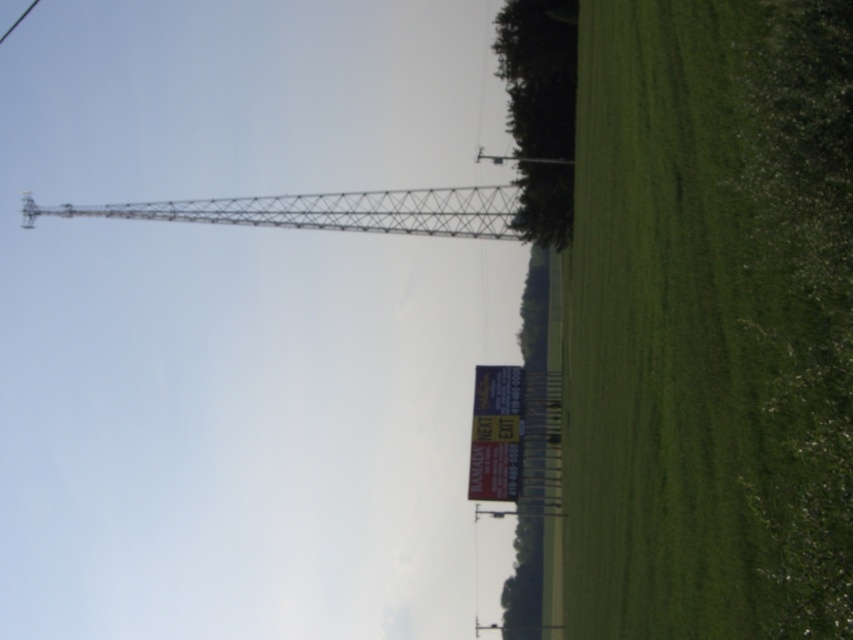
You are planning to install a new fence that is 2 meters wide between the green grass hedge at right and the metallic lattice tower at upper center. Based on their widths, will the fence fit between them?

The green grass hedge at right is narrower than the metallic lattice tower at upper center. Since the fence is 2 meters wide, it depends on the actual width between them, but the description only compares their widths, not the distance between. Therefore, we cannot determine if the fence will fit based on the provided information.